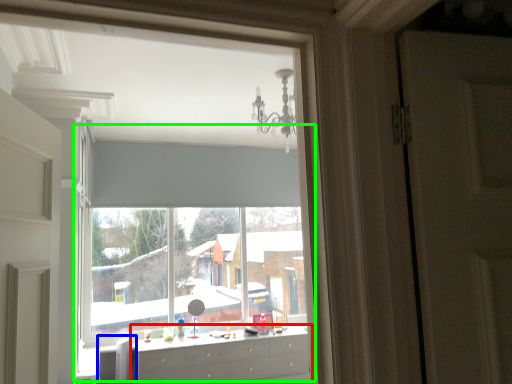
Question: Estimate the real-world distances between objects in this image. Which object is farther from chest of drawers (highlighted by a red box), swivel chair (highlighted by a blue box) or bay window (highlighted by a green box)?

Choices:
 (A) swivel chair
 (B) bay window

Answer: (B)